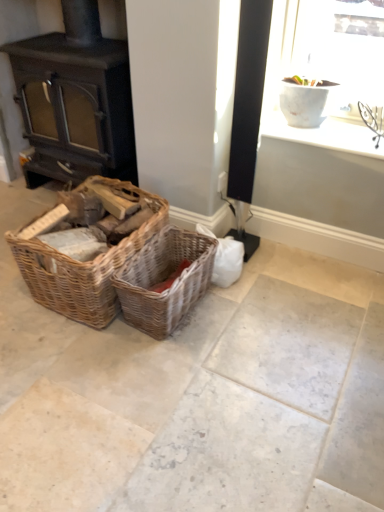
Question: From the image's perspective, is matte black wood burning stove at left on top of white ceramic vase at upper right?

Choices:
 (A) yes
 (B) no

Answer: (A)

Question: Is matte black wood burning stove at left wider than white ceramic vase at upper right?

Choices:
 (A) no
 (B) yes

Answer: (B)

Question: From the image's perspective, does matte black wood burning stove at left appear lower than white ceramic vase at upper right?

Choices:
 (A) no
 (B) yes

Answer: (A)

Question: Can you confirm if matte black wood burning stove at left is bigger than white ceramic vase at upper right?

Choices:
 (A) yes
 (B) no

Answer: (A)

Question: Is matte black wood burning stove at left aimed at white ceramic vase at upper right?

Choices:
 (A) yes
 (B) no

Answer: (B)

Question: Considering the positions of point (139, 259) and point (102, 303), is point (139, 259) closer or farther from the camera than point (102, 303)?

Choices:
 (A) farther
 (B) closer

Answer: (A)

Question: Which is correct: woven brown picnic basket at center, placed as the second picnic basket when sorted from left to right, is inside woven wood basket at left, the 1th picnic basket when ordered from left to right, or outside of it?

Choices:
 (A) inside
 (B) outside

Answer: (B)

Question: Considering the positions of woven brown picnic basket at center, the 1th picnic basket positioned from the right, and woven wood basket at left, the 1th picnic basket when ordered from left to right, in the image, is woven brown picnic basket at center, the 1th picnic basket positioned from the right, wider or thinner than woven wood basket at left, the 1th picnic basket when ordered from left to right,?

Choices:
 (A) wide
 (B) thin

Answer: (B)

Question: Is woven brown picnic basket at center, the 1th picnic basket positioned from the right, in front of or behind woven wood basket at left, the second picnic basket in the right-to-left sequence, in the image?

Choices:
 (A) front
 (B) behind

Answer: (B)

Question: Is woven brown picnic basket at center, placed as the second picnic basket when sorted from left to right, spatially inside matte black wood burning stove at left, or outside of it?

Choices:
 (A) outside
 (B) inside

Answer: (A)

Question: In terms of size, does woven brown picnic basket at center, placed as the second picnic basket when sorted from left to right, appear bigger or smaller than matte black wood burning stove at left?

Choices:
 (A) small
 (B) big

Answer: (A)

Question: In the image, is woven brown picnic basket at center, the 1th picnic basket positioned from the right, positioned in front of or behind matte black wood burning stove at left?

Choices:
 (A) behind
 (B) front

Answer: (B)

Question: Would you say woven brown picnic basket at center, placed as the second picnic basket when sorted from left to right, is to the left or to the right of matte black wood burning stove at left in the picture?

Choices:
 (A) left
 (B) right

Answer: (B)

Question: Is woven wood basket at left, the second picnic basket in the right-to-left sequence, wider or thinner than woven brown picnic basket at center, placed as the second picnic basket when sorted from left to right?

Choices:
 (A) thin
 (B) wide

Answer: (B)

Question: Does point (54, 287) appear closer or farther from the camera than point (153, 279)?

Choices:
 (A) farther
 (B) closer

Answer: (B)